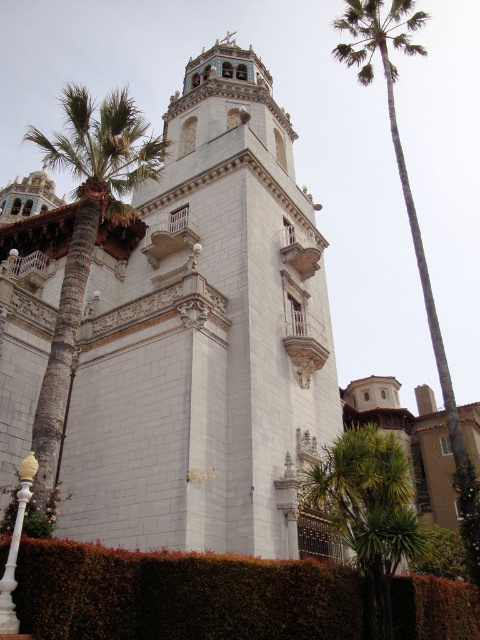
You are standing in front of the grand building and want to take a photo that includes both the white stone tower at center and the green leafy palm tree at left. Based on their positions, which object should be placed on the left side of the photo to include both in the frame?

The green leafy palm tree at left should be placed on the left side of the photo since it is positioned to the left of the white stone tower at center, allowing both to be included in the frame.